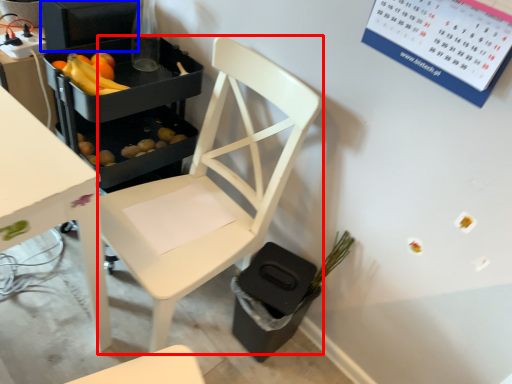
Question: Which object appears closest to the camera in this image, chair (highlighted by a red box) or appliance (highlighted by a blue box)?

Choices:
 (A) chair
 (B) appliance

Answer: (A)